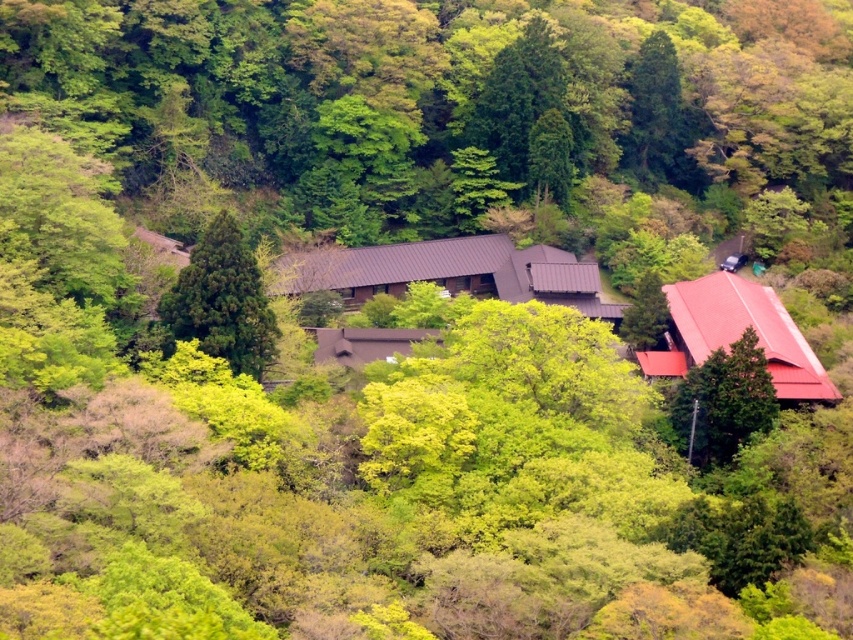
Which is behind, point (531, 246) or point (225, 250)?

The point (531, 246) is more distant.

Is point (549, 278) positioned after point (235, 317)?

Yes.

You are a GUI agent. You are given a task and a screenshot of the screen. Output one action in this format:
    pyautogui.click(x=<x>, y=<y>)
    Task: Click on the brown corrugated metal hut at center
    The width and height of the screenshot is (853, 640).
    Given the screenshot: What is the action you would take?
    pyautogui.click(x=450, y=273)

Locate an element on the screen. brown corrugated metal hut at center is located at coordinates (450, 273).

Can you confirm if green leafy tree at center is bigger than brown matte hut at center?

Correct, green leafy tree at center is larger in size than brown matte hut at center.

Measure the distance between green leafy tree at center and camera.

They are 106.41 meters apart.

Is point (234, 332) farther from camera compared to point (399, 328)?

No, (234, 332) is closer to viewer.

Locate an element on the screen. This screenshot has height=640, width=853. green leafy tree at center is located at coordinates (222, 300).

Can you confirm if brown corrugated metal hut at center is taller than brown matte hut at center?

Yes, brown corrugated metal hut at center is taller than brown matte hut at center.

Who is more distant from viewer, (434, 250) or (366, 358)?

The point (434, 250) is more distant.

Does point (459, 264) lie in front of point (387, 342)?

No, (459, 264) is further to viewer.

Where is `brown corrugated metal hut at center`? The width and height of the screenshot is (853, 640). brown corrugated metal hut at center is located at coordinates (450, 273).